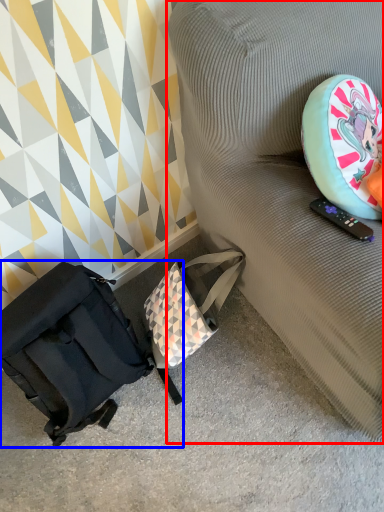
Question: Which object is further to the camera taking this photo, furniture (highlighted by a red box) or luggage and bags (highlighted by a blue box)?

Choices:
 (A) furniture
 (B) luggage and bags

Answer: (B)